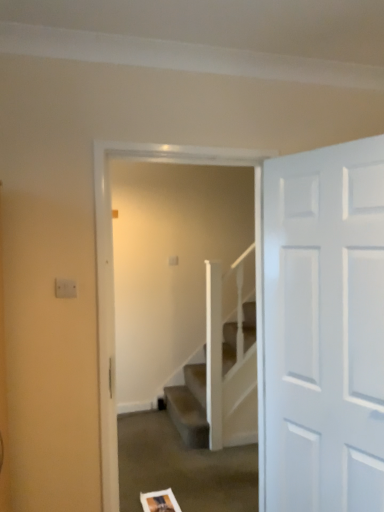
Identify the location of carpeted stairs at center. This screenshot has width=384, height=512. (113, 273).

The height and width of the screenshot is (512, 384). Describe the element at coordinates (113, 273) in the screenshot. I see `carpeted stairs at center` at that location.

Describe the element at coordinates (324, 328) in the screenshot. I see `white painted wood door at right` at that location.

What is the approximate height of white painted wood door at right?

It is 5.75 feet.

The width and height of the screenshot is (384, 512). What are the coordinates of `white painted wood door at right` in the screenshot? It's located at (324, 328).

Identify the location of carpeted stairs at center. (113, 273).

Can you confirm if carpeted stairs at center is positioned to the left of white painted wood door at right?

Indeed, carpeted stairs at center is positioned on the left side of white painted wood door at right.

Is carpeted stairs at center closer to camera compared to white painted wood door at right?

No, the depth of carpeted stairs at center is greater than that of white painted wood door at right.

Is point (101, 255) closer to camera compared to point (308, 452)?

Yes, point (101, 255) is in front of point (308, 452).

From the image's perspective, is carpeted stairs at center positioned above or below white painted wood door at right?

carpeted stairs at center is situated lower than white painted wood door at right in the image.

From a real-world perspective, does carpeted stairs at center sit lower than white painted wood door at right?

Yes, from a real-world perspective, carpeted stairs at center is below white painted wood door at right.

Does carpeted stairs at center have a lesser width compared to white painted wood door at right?

No, carpeted stairs at center is not thinner than white painted wood door at right.

Considering the relative sizes of carpeted stairs at center and white painted wood door at right in the image provided, is carpeted stairs at center taller than white painted wood door at right?

Yes, carpeted stairs at center is taller than white painted wood door at right.

Considering the relative sizes of carpeted stairs at center and white painted wood door at right in the image provided, is carpeted stairs at center bigger than white painted wood door at right?

Correct, carpeted stairs at center is larger in size than white painted wood door at right.

Is carpeted stairs at center not inside white painted wood door at right?

Yes, carpeted stairs at center is outside of white painted wood door at right.

Can you see carpeted stairs at center touching white painted wood door at right?

No, carpeted stairs at center is not making contact with white painted wood door at right.

Is carpeted stairs at center positioned with its back to white painted wood door at right?

No, white painted wood door at right is not at the back of carpeted stairs at center.

Locate an element on the screen. Image resolution: width=384 pixels, height=512 pixels. door located above the carpeted stairs at center (from the image's perspective) is located at coordinates (324, 328).

Considering the positions of objects white painted wood door at right and carpeted stairs at center in the image provided, who is more to the right, white painted wood door at right or carpeted stairs at center?

From the viewer's perspective, white painted wood door at right appears more on the right side.

Is white painted wood door at right positioned before carpeted stairs at center?

Yes, white painted wood door at right is closer to the camera.

Between point (381, 420) and point (101, 238), which one is positioned in front?

Point (381, 420)

From the image's perspective, is white painted wood door at right above carpeted stairs at center?

Yes, from the image's perspective, white painted wood door at right is over carpeted stairs at center.

From a real-world perspective, is white painted wood door at right physically above carpeted stairs at center?

Yes, from a real-world perspective, white painted wood door at right is over carpeted stairs at center

Which object is wider, white painted wood door at right or carpeted stairs at center?

carpeted stairs at center.

Can you confirm if white painted wood door at right is shorter than carpeted stairs at center?

Yes.

Considering the relative sizes of white painted wood door at right and carpeted stairs at center in the image provided, is white painted wood door at right bigger than carpeted stairs at center?

Actually, white painted wood door at right might be smaller than carpeted stairs at center.

Consider the image. Could carpeted stairs at center be considered to be inside white painted wood door at right?

No, carpeted stairs at center is not surrounded by white painted wood door at right.

Does white painted wood door at right touch carpeted stairs at center?

No, white painted wood door at right is not making contact with carpeted stairs at center.

Is white painted wood door at right facing towards carpeted stairs at center?

No, white painted wood door at right is not aimed at carpeted stairs at center.

Locate an element on the screen. The height and width of the screenshot is (512, 384). door that is on the right side of carpeted stairs at center is located at coordinates (324, 328).

At what (x,y) coordinates should I click in order to perform the action: click on door positioned vertically above the carpeted stairs at center (from a real-world perspective). Please return your answer as a coordinate pair (x, y). This screenshot has width=384, height=512. Looking at the image, I should click on (324, 328).

Find the location of a particular element. The width and height of the screenshot is (384, 512). door located above the carpeted stairs at center (from the image's perspective) is located at coordinates (324, 328).